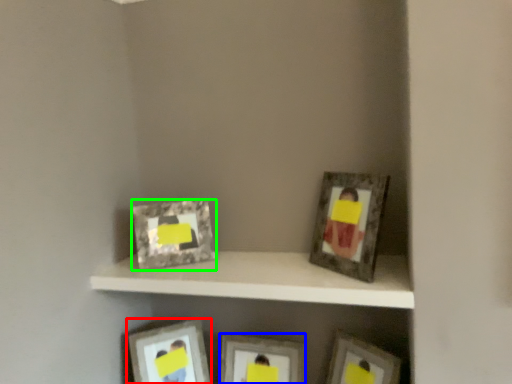
Question: Based on their relative distances, which object is farther from picture frame (highlighted by a red box)? Choose from picture frame (highlighted by a blue box) and picture frame (highlighted by a green box).

Choices:
 (A) picture frame
 (B) picture frame

Answer: (B)